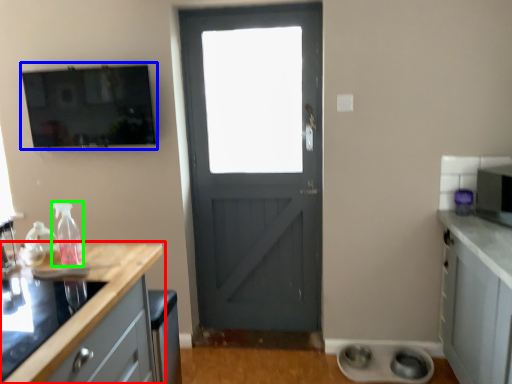
Question: Estimate the real-world distances between objects in this image. Which object is closer to countertop (highlighted by a red box), window screen (highlighted by a blue box) or bottle (highlighted by a green box)?

Choices:
 (A) window screen
 (B) bottle

Answer: (B)